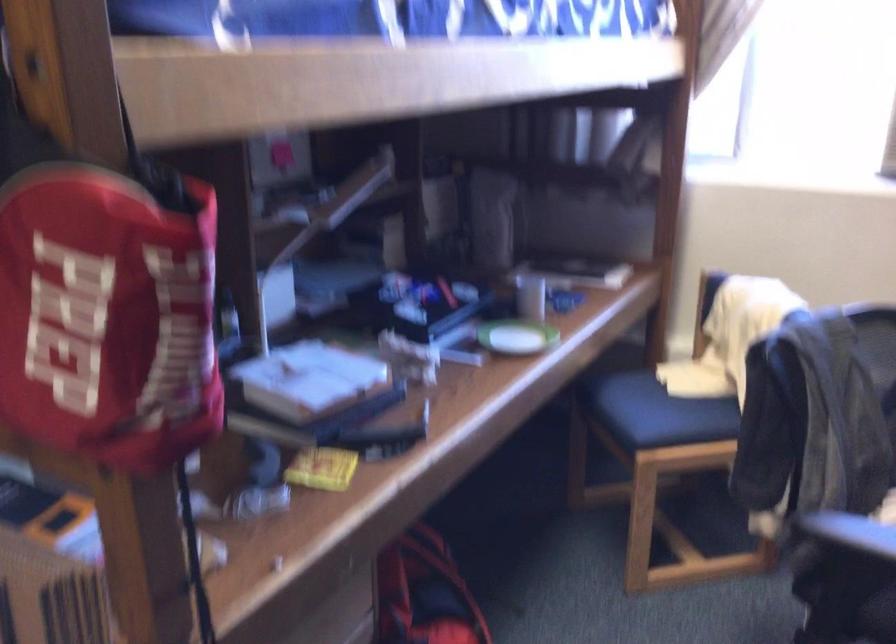
I want to click on small green saucer, so click(x=515, y=337).